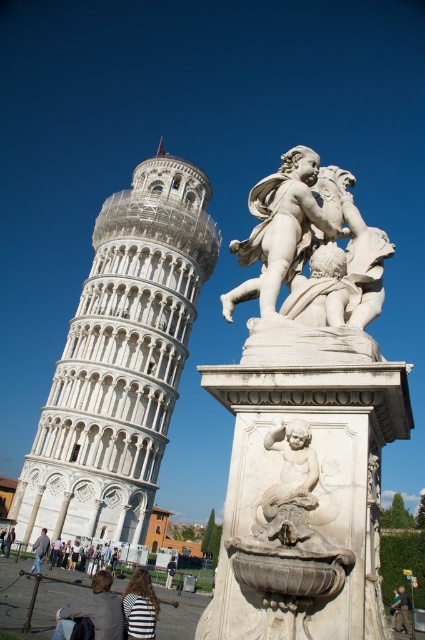
You are a tour guide leading a group to the Leaning Tower of Pisa. You have a striped fabric at lower center and a light brown leather jacket at lower left in your bag. Your group wants to know if they can fit both items on a 30 meter long shelf in the gift shop. Can both items fit on the shelf if placed end to end?

The striped fabric at lower center and light brown leather jacket at lower left are 28.40 meters apart from each other. Since the total length required is 28.40 meters and the shelf is 30 meters long, both items can fit on the shelf when placed end to end.

You are a photographer standing at the base of the Leaning Tower of Pisa. You want to take a photo that includes both the striped fabric at lower center and the light brown leather jacket at lower left. Based on their positions, which object should appear closer to the camera in the photo?

The striped fabric at lower center should appear closer to the camera because it is in front of the light brown leather jacket at lower left.

You are a photographer setting up a tripod in the lower center of the image. You notice the striped fabric at lower center and the light brown leather jacket at lower center. Which object is positioned higher relative to the other?

The striped fabric at lower center is above the light brown leather jacket at lower center, so the striped fabric is higher.